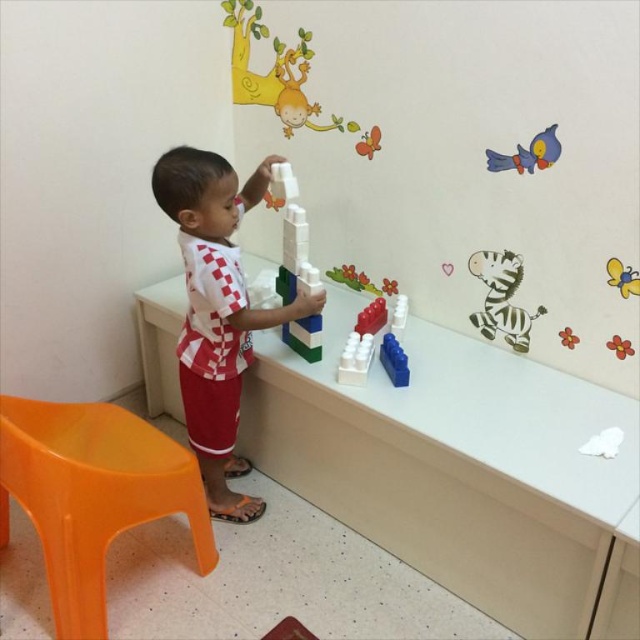
The child is trying to place a new block on the tower. Considering the position of the white plastic blocks at center and the white matte zebra at upper right, which object is closer to the child?

The white plastic blocks at center are closer to the child because they are in front of the white matte zebra at upper right.

The scene shows a child building with blocks at a table. There is a point marked at coordinates [291,236]. What object is this point located on?

The point at coordinates [291,236] is located on the white plastic blocks at center.

You are a child trying to touch the blue matte bird at upper right and the white matte zebra at upper right on the wall. Which one would you need to reach further back to touch?

The blue matte bird at upper right is behind the white matte zebra at upper right, so you would need to reach further back to touch the blue matte bird at upper right.